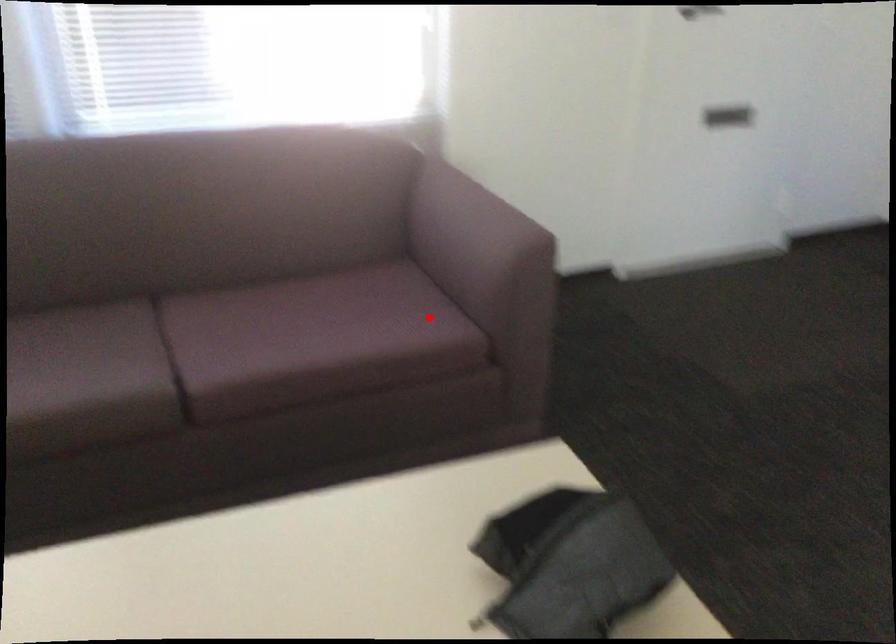
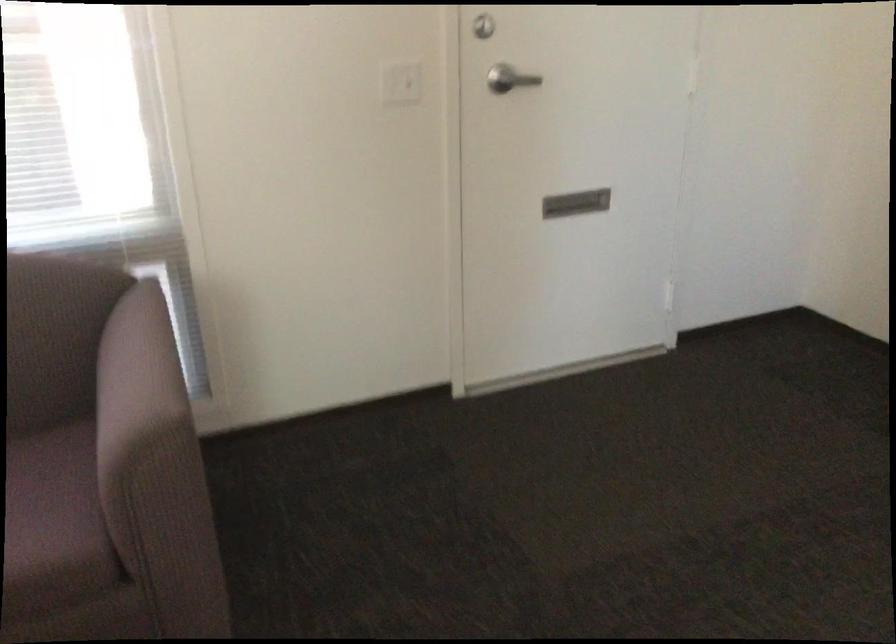
Question: A red point is marked in image1. In image2, is the corresponding 3D point closer to the camera or farther? Reply with the corresponding letter.

Choices:
 (A) The corresponding 3D point is closer.
 (B) The corresponding 3D point is farther.

Answer: (A)